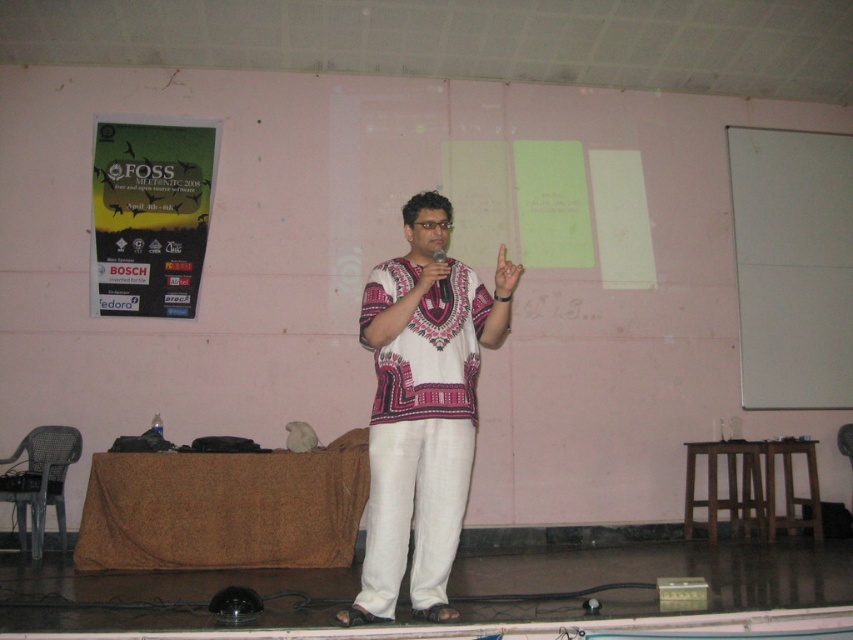
You are an event coordinator trying to decide where to place a new banner. The banner is the same size as the paper poster at left. If you want to place the banner next to the white cotton shirt at center, will the banner be smaller than the shirt?

The white cotton shirt at center is larger in size than the paper poster at left, so the banner, being the same size as the paper poster at left, will indeed be smaller than the shirt.

You are an event organizer who needs to ensure all items on stage are visible to the audience. Given that the white cotton shirt at center and the paper poster at left are both on the stage, which item is more likely to block the view of the other?

The white cotton shirt at center is much taller than the paper poster at left, so it is more likely to block the view of the paper poster at left.

Based on the scene description, where is the white cotton shirt at center located in terms of its 2D coordinates?

The white cotton shirt at center is located at the 2D coordinates point (421, 412).